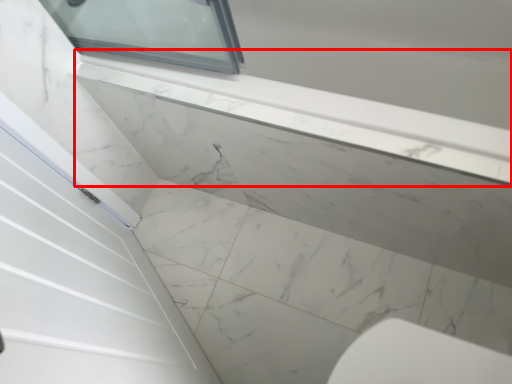
Question: Considering the relative positions of window sill (annotated by the red box) and concrete in the image provided, where is window sill (annotated by the red box) located with respect to the staircase?

Choices:
 (A) right
 (B) left

Answer: (A)